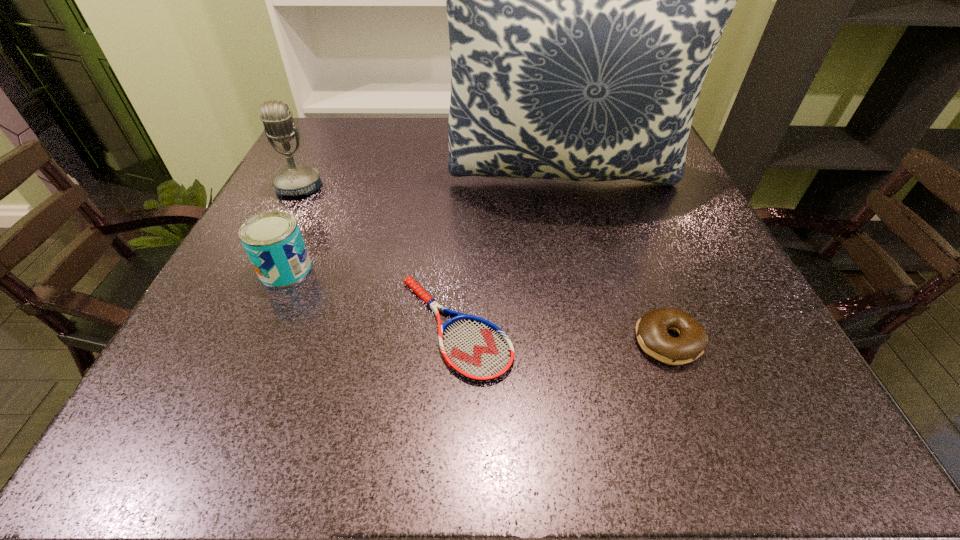
Find the location of a particular element. This screenshot has height=540, width=960. the tallest object is located at coordinates (585, 0).

I want to click on microphone, so click(294, 180).

Where is `the third shortest object`? This screenshot has height=540, width=960. the third shortest object is located at coordinates (272, 240).

Where is `doughnut`? The width and height of the screenshot is (960, 540). doughnut is located at coordinates (651, 329).

Locate an element on the screen. The image size is (960, 540). tennis racket is located at coordinates (476, 349).

Identify the location of free space located 0.350m on the front surface of the cushion. (610, 360).

The height and width of the screenshot is (540, 960). In order to click on free space located 0.180m on the front-facing side of the microphone in this screenshot , I will do `click(264, 256)`.

Where is `free space located on the right of the can`? Image resolution: width=960 pixels, height=540 pixels. free space located on the right of the can is located at coordinates (442, 269).

Image resolution: width=960 pixels, height=540 pixels. Identify the location of vacant region located 0.050m on the front of the doughnut. (689, 400).

Where is `free space located on the left of the shortest object`? free space located on the left of the shortest object is located at coordinates (335, 327).